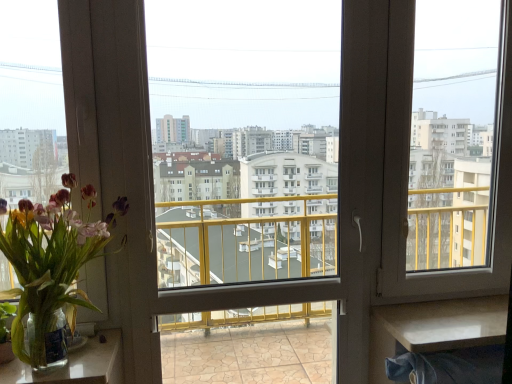
Where is `free point below transparent glass window screen at right, the second window screen viewed from the left (from a real-world perspective)`? The width and height of the screenshot is (512, 384). free point below transparent glass window screen at right, the second window screen viewed from the left (from a real-world perspective) is located at coordinates [454, 299].